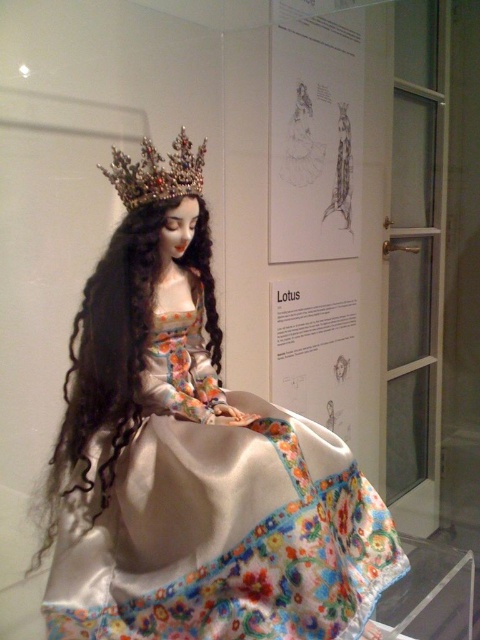
Which is behind, point (337, 460) or point (122, 154)?

Point (337, 460)

Can you confirm if silky satin dress at center is positioned above sparkling gemstone crown at upper center?

Incorrect, silky satin dress at center is not positioned above sparkling gemstone crown at upper center.

This screenshot has width=480, height=640. What are the coordinates of `silky satin dress at center` in the screenshot? It's located at (192, 458).

Which of these two, silky brown hair at center or sparkling gemstone crown at upper center, stands shorter?

sparkling gemstone crown at upper center is shorter.

Is the position of silky brown hair at center more distant than that of sparkling gemstone crown at upper center?

No, it is not.

Which is in front, point (214, 310) or point (119, 164)?

Point (119, 164) is in front.

At what (x,y) coordinates should I click in order to perform the action: click on silky brown hair at center. Please return your answer as a coordinate pair (x, y). The image size is (480, 640). Looking at the image, I should click on (108, 355).

Between point (144, 474) and point (118, 360), which one is positioned behind?

Positioned behind is point (118, 360).

Can you confirm if silky satin dress at center is smaller than silky brown hair at center?

No.

Does point (259, 506) come farther from viewer compared to point (140, 336)?

No, it is in front of (140, 336).

Find the location of `silky satin dress at center`. silky satin dress at center is located at coordinates (192, 458).